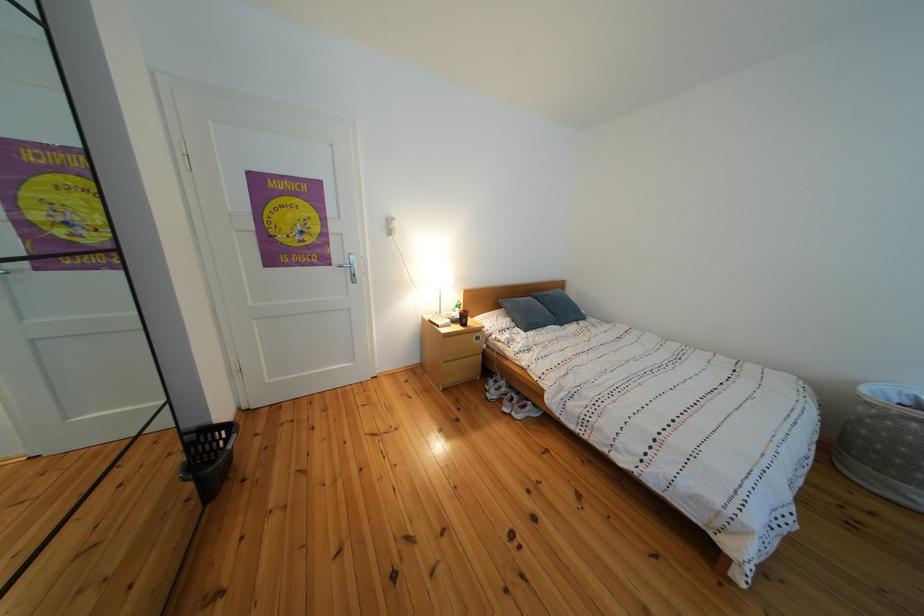
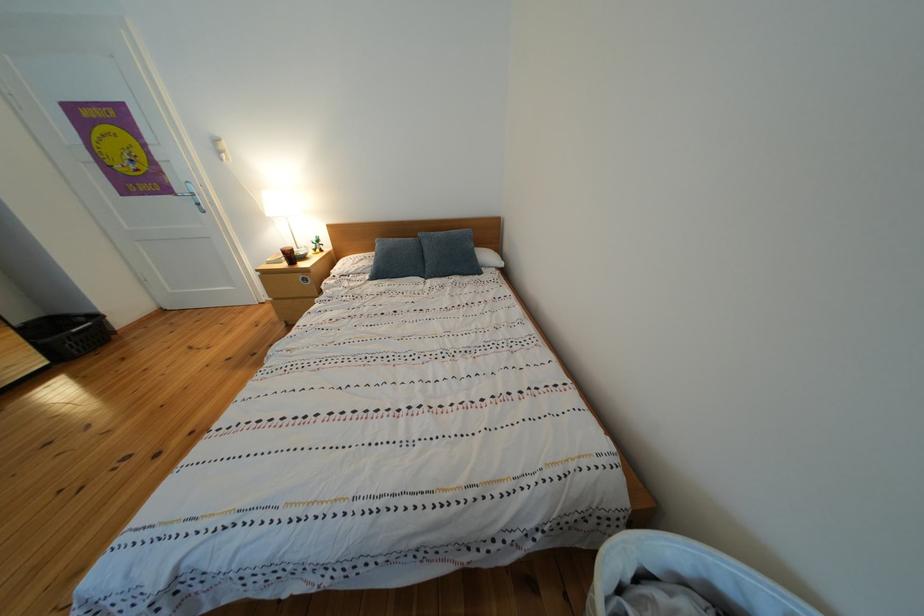
What movement of the cameraman would produce the second image?

The cameraman moved toward right, forward.